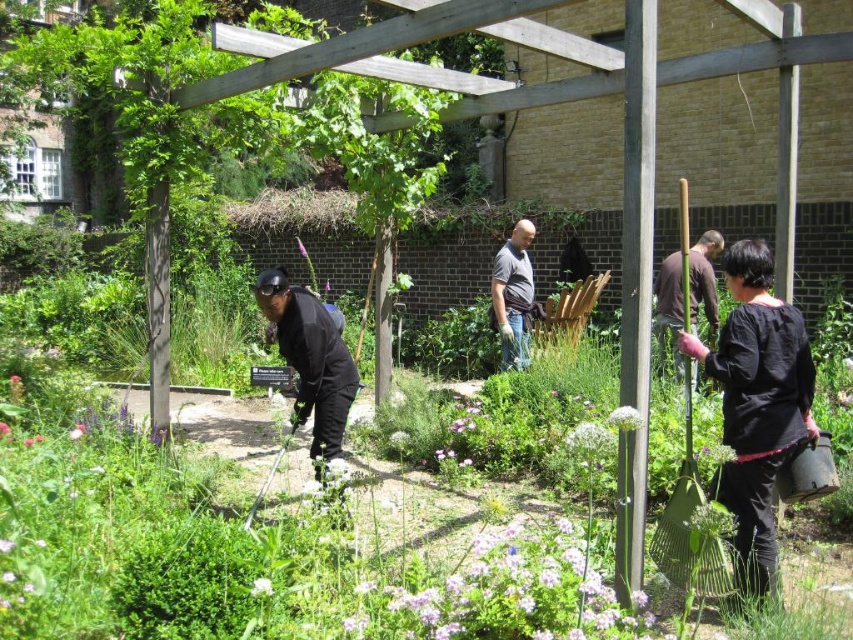
Does brown fabric shirt at right have a greater width compared to dark gray shirt at center?

Correct, the width of brown fabric shirt at right exceeds that of dark gray shirt at center.

Is brown fabric shirt at right to the right of dark gray shirt at center from the viewer's perspective?

Yes, brown fabric shirt at right is to the right of dark gray shirt at center.

Between point (692, 289) and point (524, 273), which one is positioned behind?

The point (524, 273) is more distant.

Identify the location of brown fabric shirt at right. (669, 308).

From the picture: Who is positioned more to the left, black matte shirt at lower right or dark gray shirt at center?

dark gray shirt at center is more to the left.

Which of these two, black matte shirt at lower right or dark gray shirt at center, stands taller?

black matte shirt at lower right is taller.

I want to click on black matte shirt at lower right, so click(757, 404).

Find the location of a particular element. This screenshot has height=640, width=853. black matte shirt at lower right is located at coordinates (757, 404).

Can you confirm if black matte shirt at lower right is thinner than brown fabric shirt at right?

No, black matte shirt at lower right is not thinner than brown fabric shirt at right.

Find the location of a particular element. black matte shirt at lower right is located at coordinates (757, 404).

Image resolution: width=853 pixels, height=640 pixels. I want to click on black matte shirt at lower right, so click(x=757, y=404).